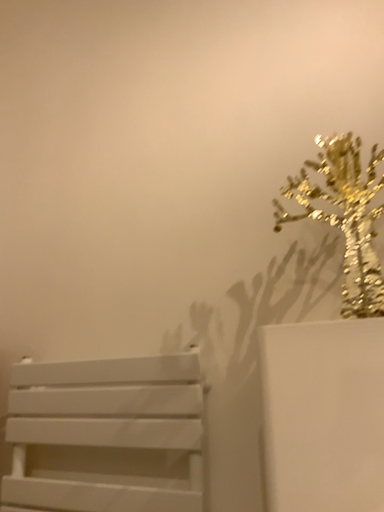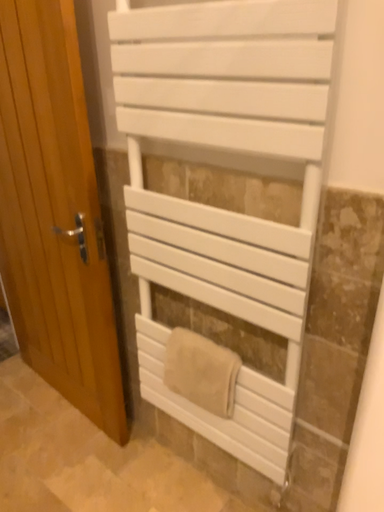
Question: Which way did the camera rotate in the video?

Choices:
 (A) rotated right
 (B) rotated left

Answer: (B)